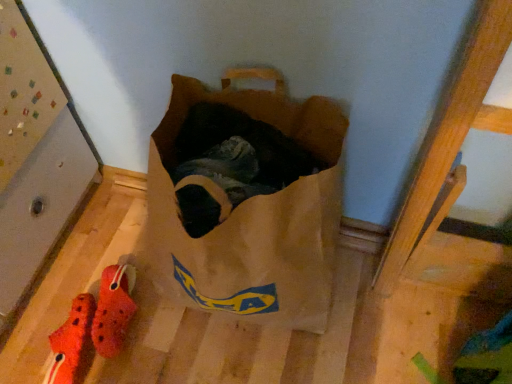
Locate an element on the screen. The width and height of the screenshot is (512, 384). free space to the left of rubberized red croc at lower left, arranged as the second footwear when viewed from the left is located at coordinates (49, 307).